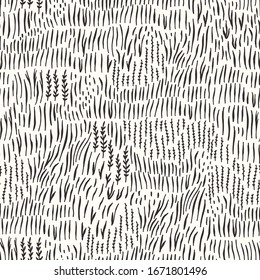
This screenshot has height=280, width=260. Identify the location of windy field grasscloth wallpaper. (80, 81), (193, 131), (112, 217).